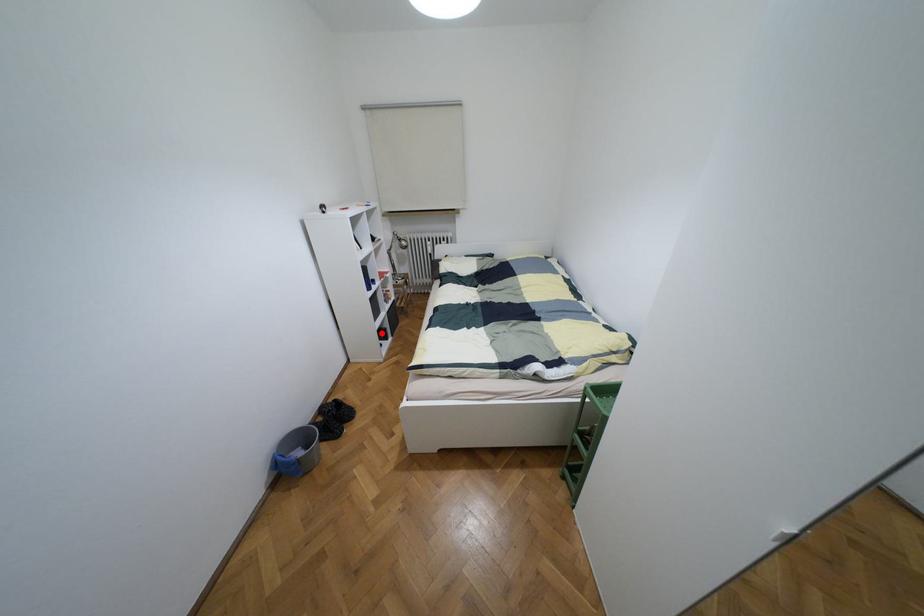
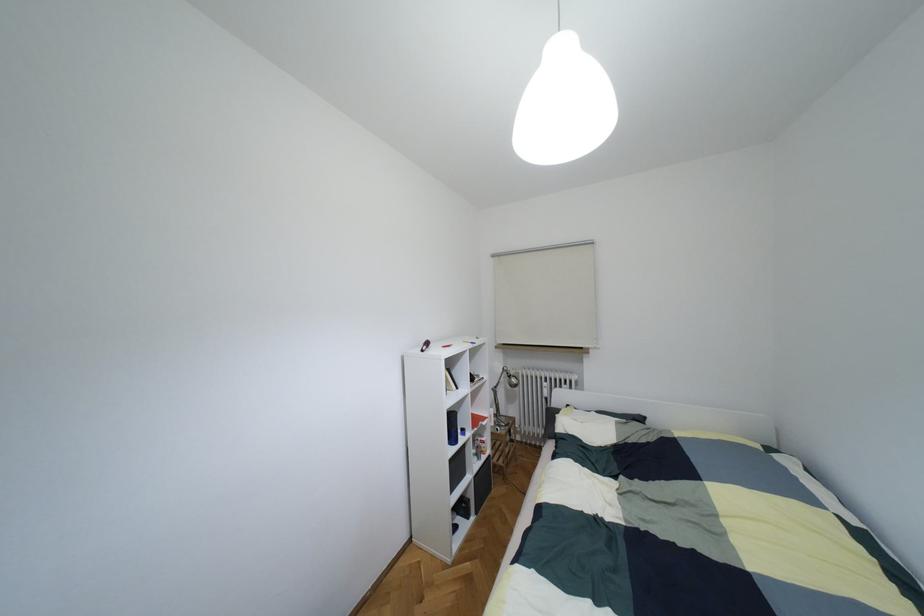
Question: I am providing you with two images of the same scene from different viewpoints. A red point is shown in image1. For the corresponding object point in image2, is it positioned nearer or farther from the camera?

Choices:
 (A) Nearer
 (B) Farther

Answer: (B)